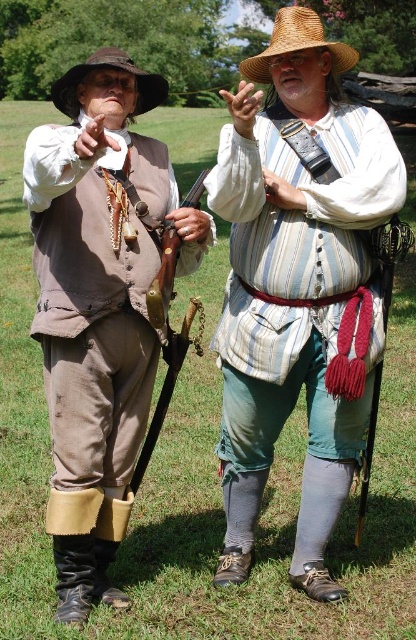
Who is taller, matte brown vest at left or wooden rifle at center?

With more height is matte brown vest at left.

Can you confirm if matte brown vest at left is positioned above wooden rifle at center?

No.

The width and height of the screenshot is (416, 640). Identify the location of matte brown vest at left. (98, 307).

Is matte brown vest at left bigger than strawhat at upper center?

Incorrect, matte brown vest at left is not larger than strawhat at upper center.

Between point (161, 161) and point (299, 4), which one is positioned behind?

The point (299, 4) is more distant.

This screenshot has height=640, width=416. Find the location of `matte brown vest at left`. matte brown vest at left is located at coordinates (98, 307).

Between point (230, 140) and point (160, 285), which one is positioned behind?

Positioned behind is point (160, 285).

Is striped fabric shirt at center shorter than wooden rifle at center?

In fact, striped fabric shirt at center may be taller than wooden rifle at center.

What do you see at coordinates (299, 310) in the screenshot?
I see `striped fabric shirt at center` at bounding box center [299, 310].

The image size is (416, 640). In order to click on striped fabric shirt at center in this screenshot , I will do `click(299, 310)`.